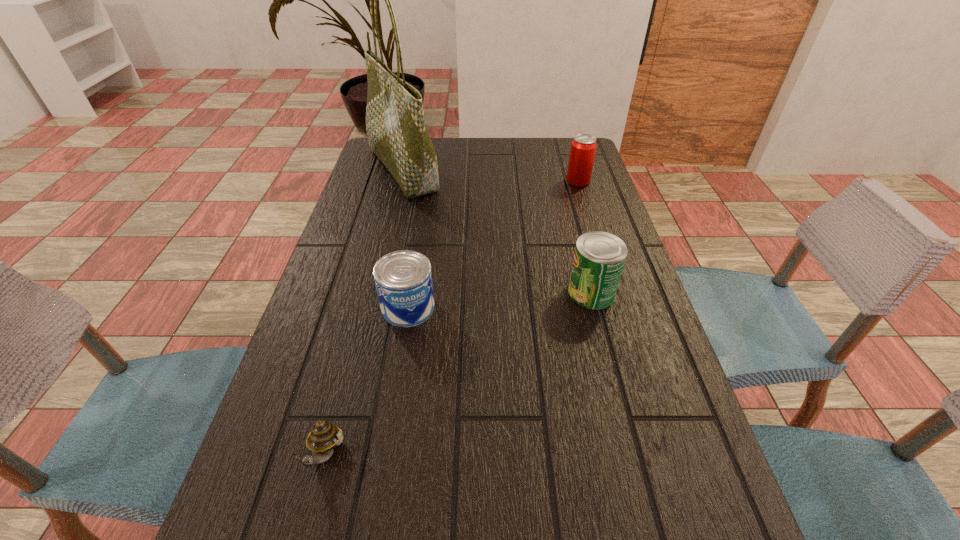
This screenshot has height=540, width=960. I want to click on snail positioned at the left edge, so click(324, 436).

At what (x,y) coordinates should I click in order to perform the action: click on object located at the far left corner. Please return your answer as a coordinate pair (x, y). This screenshot has height=540, width=960. Looking at the image, I should click on [397, 132].

The height and width of the screenshot is (540, 960). I want to click on vacant space at the far edge of the desktop, so click(526, 162).

The height and width of the screenshot is (540, 960). I want to click on blank space at the left edge of the desktop, so click(228, 525).

Identify the location of vacant space at the right edge. (571, 259).

Where is `vacant space at the far left corner of the desktop`? vacant space at the far left corner of the desktop is located at coordinates (368, 158).

Identify the location of free spot between the leftmost can and the tallest object. (405, 238).

This screenshot has height=540, width=960. In order to click on empty space that is in between the farthest can and the nearest object in this screenshot , I will do `click(451, 319)`.

Find the location of a particular element. The image size is (960, 540). vacant area that lies between the leftmost can and the farthest can is located at coordinates (493, 244).

This screenshot has width=960, height=540. Identify the location of vacant area that lies between the leftmost can and the snail. (367, 382).